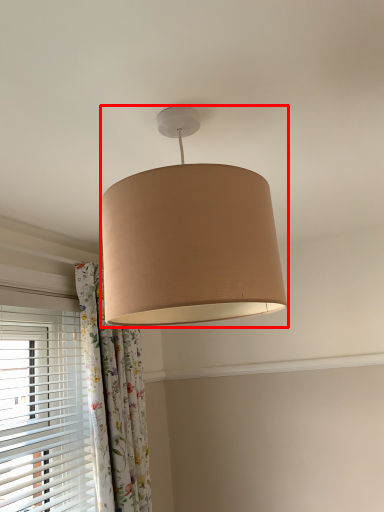
Question: From the image, what is the correct spatial relationship of lamp (annotated by the red box) in relation to curtain?

Choices:
 (A) right
 (B) left

Answer: (A)